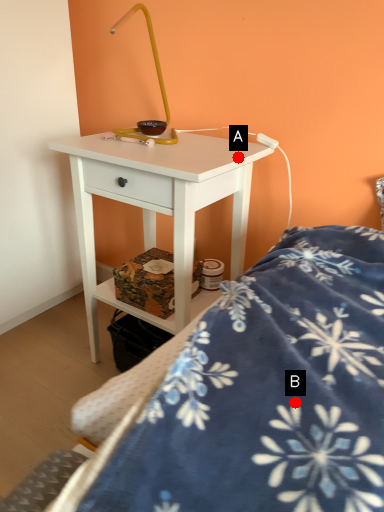
Question: Two points are circled on the image, labeled by A and B beside each circle. Which of the following is the farthest from the observer?

Choices:
 (A) A is further
 (B) B is further

Answer: (A)